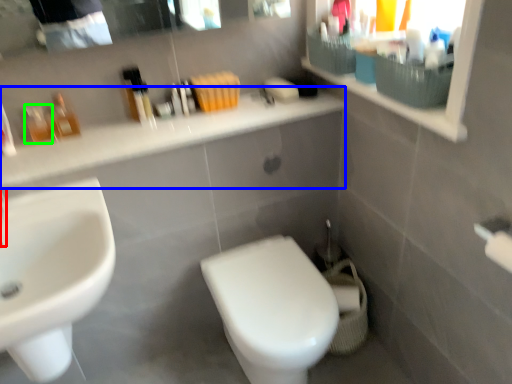
Question: Which is farther away from faucet (highlighted by a red box)? counter top (highlighted by a blue box) or toiletry (highlighted by a green box)?

Choices:
 (A) counter top
 (B) toiletry

Answer: (A)